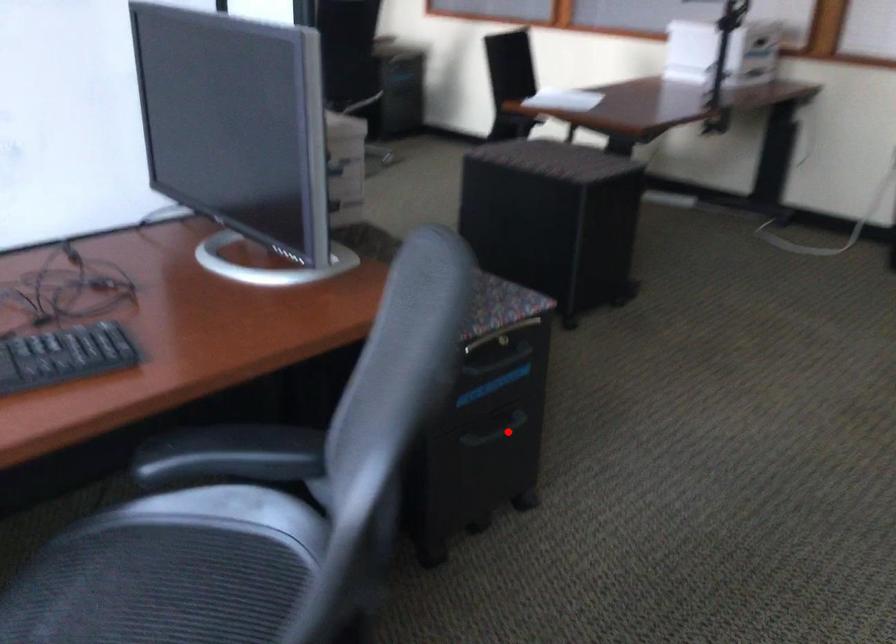
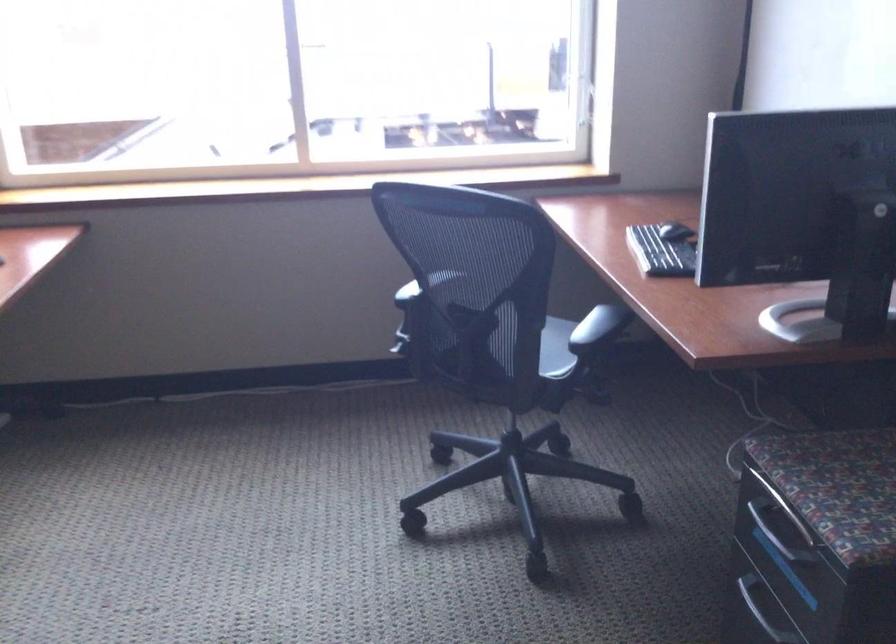
Question: I am providing you with two images of the same scene from different viewpoints. A red point is marked on the first image. Is the red point's position out of view in image 2?

Choices:
 (A) Yes
 (B) No

Answer: (B)